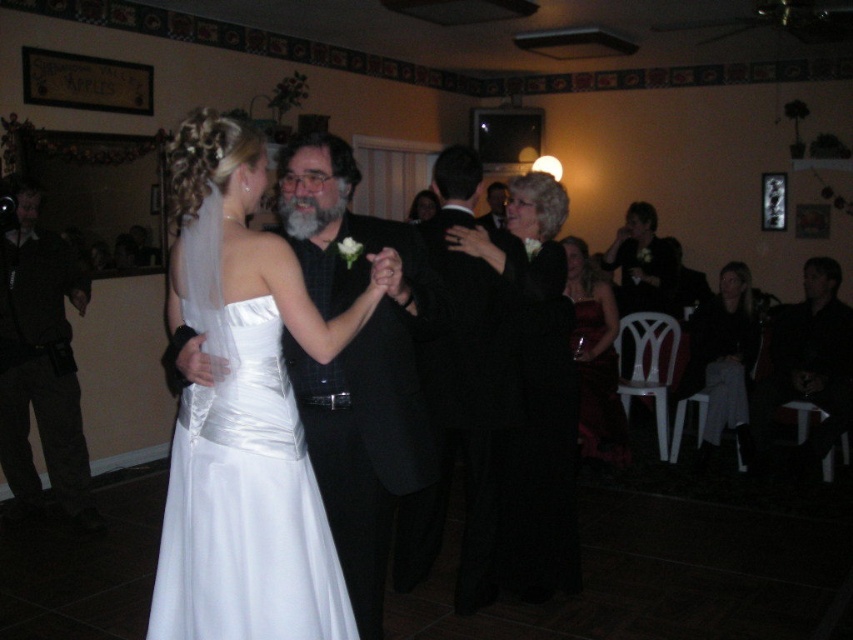
Question: Which object is positioned farthest from the dark brown leather pants at left?

Choices:
 (A) black textured suit at center
 (B) shiny red dress at lower right
 (C) satin dress at center
 (D) matte black dress at upper center

Answer: (D)

Question: Estimate the real-world distances between objects in this image. Which object is closer to the dark brown leather pants at left?

Choices:
 (A) black satin suit at center
 (B) shiny red dress at lower right
 (C) black textured suit at center

Answer: (A)

Question: Can you confirm if dark brown leather pants at left is positioned below shiny red dress at lower right?

Choices:
 (A) yes
 (B) no

Answer: (A)

Question: Estimate the real-world distances between objects in this image. Which object is closer to the matte black dress at upper center?

Choices:
 (A) dark brown leather pants at left
 (B) satin dress at center
 (C) black textured suit at center
 (D) light gray fabric dress at lower right

Answer: (D)

Question: Is black textured suit at center to the right of dark brown leather pants at left from the viewer's perspective?

Choices:
 (A) yes
 (B) no

Answer: (A)

Question: Can you confirm if black satin dress at center is positioned above shiny red dress at lower right?

Choices:
 (A) no
 (B) yes

Answer: (A)